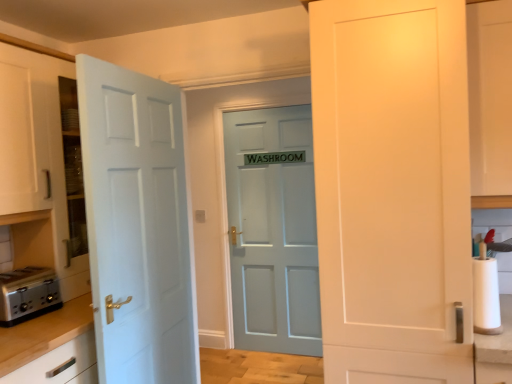
The image size is (512, 384). In order to click on vacant region above matte blue door at center, marked as the third door in a front-to-back arrangement (from a real-world perspective) in this screenshot , I will do `click(270, 99)`.